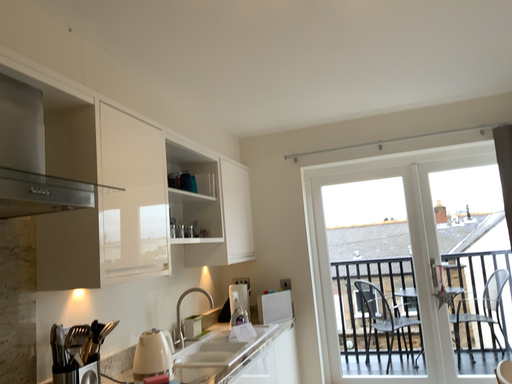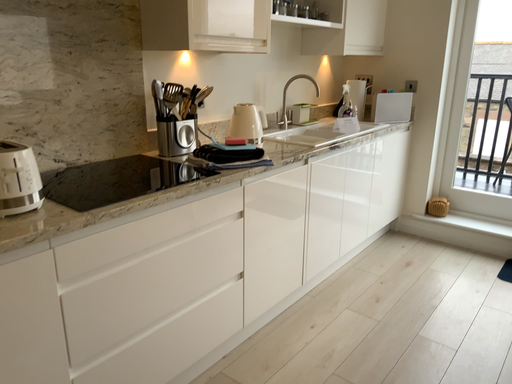
Question: How did the camera likely rotate when shooting the video?

Choices:
 (A) rotated left
 (B) rotated right

Answer: (A)